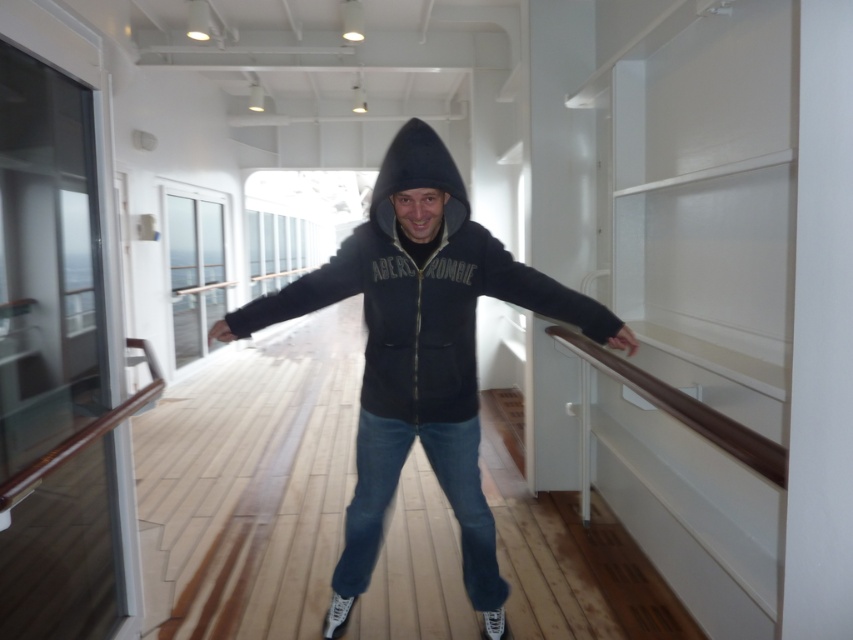
You are a tailor measuring two hoodies for alterations. The black cotton hoodie at center and the black fleece hoodie at center are both on the deck. If the minimum distance required for your measuring tape to reach both is 40 cm, can you measure them without moving either hoodie?

The black cotton hoodie at center is 43.71 centimeters from the black fleece hoodie at center. Since the distance exceeds the 40 cm minimum requirement, the measuring tape can reach both hoodies without needing to move them.

Based on the photo, you are a fashion stylist trying to style a customer for a photoshoot on a ship deck. The customer has two hoodies, the black cotton hoodie at center and the black fleece hoodie at center. They want to wear one hoodie over the other. Based on the image, which hoodie should be worn on top?

The black fleece hoodie at center should be worn on top since the black cotton hoodie at center is positioned under it in the image.

You are a fashion designer observing the two hoodies on the deck. Which one has a larger width, the black cotton hoodie at center or the black fleece hoodie at center?

The black cotton hoodie at center has a larger width than the black fleece hoodie at center according to the description.